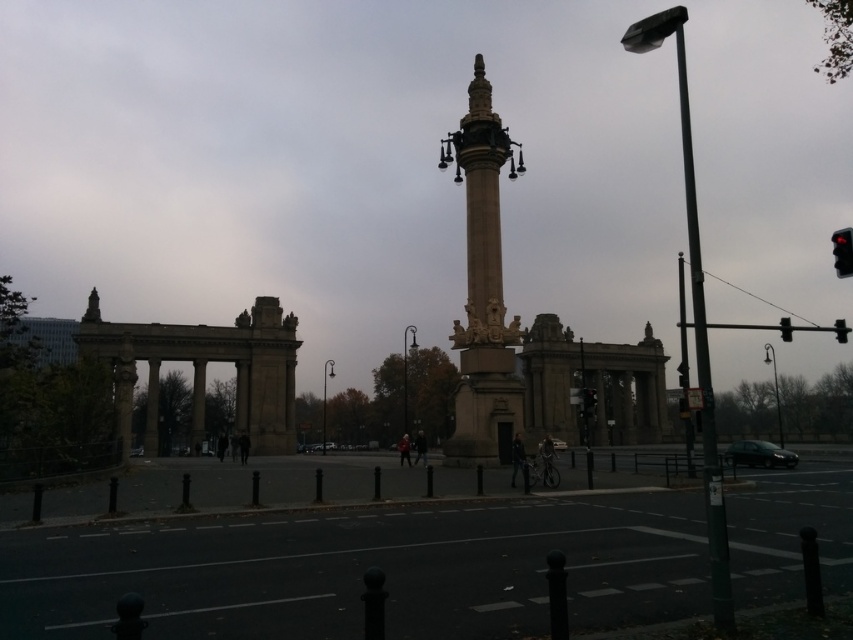
Question: Does smooth stone column at center appear under black plastic traffic light at right?

Choices:
 (A) no
 (B) yes

Answer: (A)

Question: Which of the following is the closest to the observer?

Choices:
 (A) (693, 320)
 (B) (844, 243)
 (C) (466, 179)
 (D) (846, 328)

Answer: (C)

Question: Which of the following is the closest to the observer?

Choices:
 (A) (585, 390)
 (B) (836, 320)
 (C) (846, 250)

Answer: (C)

Question: Considering the relative positions of smooth stone column at center and black glass traffic light at upper right in the image provided, where is smooth stone column at center located with respect to black glass traffic light at upper right?

Choices:
 (A) below
 (B) above

Answer: (A)

Question: Does green metallic pole at right appear under red plastic traffic light at right?

Choices:
 (A) no
 (B) yes

Answer: (A)

Question: Which of the following is the farthest from the observer?

Choices:
 (A) (843, 269)
 (B) (846, 333)
 (C) (790, 336)

Answer: (C)